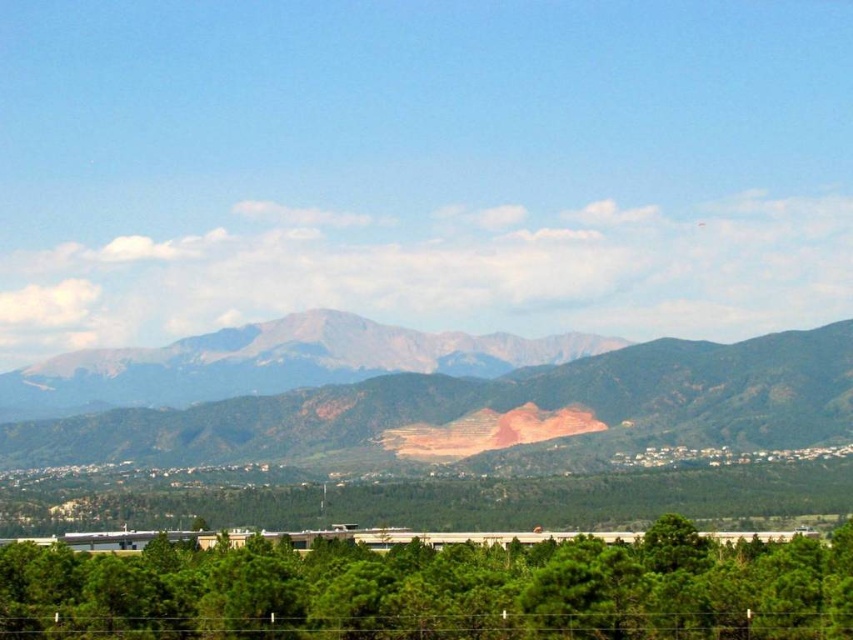
Can you confirm if green leafy tree at lower center is positioned to the left of rugged brown mountain range at center?

Incorrect, green leafy tree at lower center is not on the left side of rugged brown mountain range at center.

Image resolution: width=853 pixels, height=640 pixels. What do you see at coordinates (437, 589) in the screenshot?
I see `green leafy tree at lower center` at bounding box center [437, 589].

Is point (152, 625) farther from viewer compared to point (335, 424)?

No.

The width and height of the screenshot is (853, 640). In order to click on green leafy tree at lower center in this screenshot , I will do `click(437, 589)`.